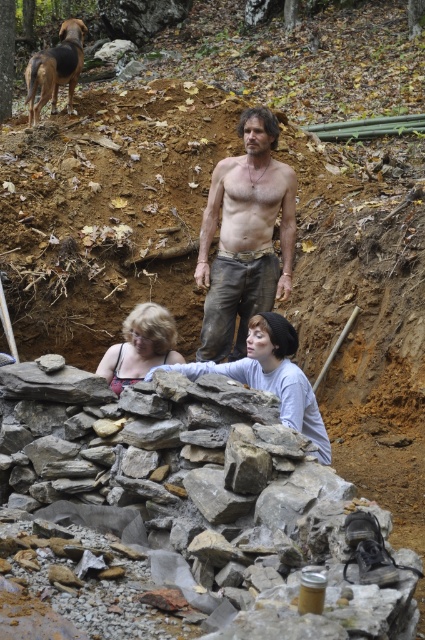
You are a delivery robot with a 1.2 meter wide package. You need to move from the gray rough stone at center to the matte black tank top at center. Can you fit through the space between them?

The distance between the gray rough stone at center and the matte black tank top at center is 1.15 meters, which is narrower than the 1.2 meter wide package. Therefore, the robot cannot fit through the space between them.